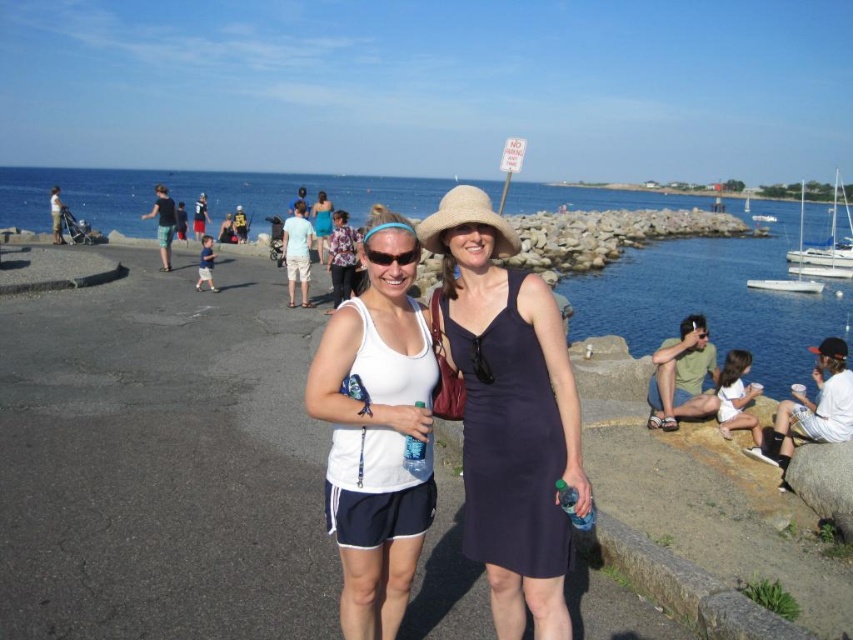
Does white matte tank top at center have a lesser width compared to white glossy sailboat at right?

Correct, white matte tank top at center's width is less than white glossy sailboat at right's.

Measure the distance between point (413, 404) and camera.

Point (413, 404) and camera are 15.30 feet apart from each other.

Is point (390, 275) farther from camera compared to point (787, 291)?

No, it is in front of (787, 291).

Find the location of `white matte tank top at center`. white matte tank top at center is located at coordinates (376, 435).

Between white matte tank top at center and white sailboat at right, which one is positioned higher?

white sailboat at right is above.

Can you confirm if white matte tank top at center is bigger than white sailboat at right?

No, white matte tank top at center is not bigger than white sailboat at right.

This screenshot has width=853, height=640. Describe the element at coordinates (376, 435) in the screenshot. I see `white matte tank top at center` at that location.

The image size is (853, 640). In order to click on white matte tank top at center in this screenshot , I will do `click(376, 435)`.

Is white matte tank top at center to the right of navy satin dress at center from the viewer's perspective?

Incorrect, white matte tank top at center is not on the right side of navy satin dress at center.

Between white matte tank top at center and navy satin dress at center, which one has less height?

→ Standing shorter between the two is navy satin dress at center.

Identify the location of white matte tank top at center. The height and width of the screenshot is (640, 853). (376, 435).

Locate an element on the screen. The width and height of the screenshot is (853, 640). white matte tank top at center is located at coordinates (376, 435).